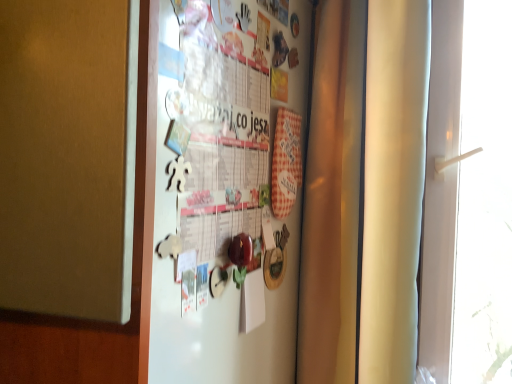
Locate an element on the screen. The width and height of the screenshot is (512, 384). white paperboard fridge at center is located at coordinates (224, 189).

In order to face white paperboard fridge at center, should I rotate leftwards or rightwards?

Rotate right and turn 0.875 degrees.

The image size is (512, 384). Describe the element at coordinates (224, 189) in the screenshot. I see `white paperboard fridge at center` at that location.

The image size is (512, 384). What are the coordinates of `white plastic handle at right` in the screenshot? It's located at (468, 198).

This screenshot has width=512, height=384. What do you see at coordinates (468, 198) in the screenshot?
I see `white plastic handle at right` at bounding box center [468, 198].

What is the approximate height of white plastic handle at right?

3.55 feet.

Measure the distance between point [436,375] and camera.

The distance of point [436,375] from camera is 4.06 feet.

The height and width of the screenshot is (384, 512). Find the location of `white paperboard fridge at center`. white paperboard fridge at center is located at coordinates (224, 189).

Is white paperboard fridge at center at the right side of white plastic handle at right?

Incorrect, white paperboard fridge at center is not on the right side of white plastic handle at right.

Which object is closer to the camera, white paperboard fridge at center or white plastic handle at right?

white paperboard fridge at center is closer to the camera.

Which is behind, point (278, 30) or point (484, 224)?

Point (484, 224)

From the image's perspective, is white paperboard fridge at center located above or below white plastic handle at right?

From the image's perspective, white paperboard fridge at center appears above white plastic handle at right.

From a real-world perspective, is white paperboard fridge at center physically located above or below white plastic handle at right?

Clearly, from a real-world perspective, white paperboard fridge at center is above white plastic handle at right.

In terms of width, does white paperboard fridge at center look wider or thinner when compared to white plastic handle at right?

white paperboard fridge at center is thinner than white plastic handle at right.

Considering the relative sizes of white paperboard fridge at center and white plastic handle at right in the image provided, is white paperboard fridge at center shorter than white plastic handle at right?

Yes.

Considering the sizes of white paperboard fridge at center and white plastic handle at right in the image, is white paperboard fridge at center bigger or smaller than white plastic handle at right?

Considering their sizes, white paperboard fridge at center takes up less space than white plastic handle at right.

Which is correct: white paperboard fridge at center is inside white plastic handle at right, or outside of it?

white paperboard fridge at center lies outside white plastic handle at right.

Is white paperboard fridge at center far away from white plastic handle at right?

No.

Is white paperboard fridge at center oriented away from white plastic handle at right?

No, white paperboard fridge at center is not facing away from white plastic handle at right.

How many degrees apart are the facing directions of white paperboard fridge at center and white plastic handle at right?

The angular difference between white paperboard fridge at center and white plastic handle at right is 93.1 degrees.

The image size is (512, 384). I want to click on window below the white paperboard fridge at center (from a real-world perspective), so click(468, 198).

Consider the image. Which object is positioned more to the right, white plastic handle at right or white paperboard fridge at center?

From the viewer's perspective, white plastic handle at right appears more on the right side.

Which object is further away from the camera, white plastic handle at right or white paperboard fridge at center?

white plastic handle at right is behind.

Which is nearer, (495, 49) or (265, 47)?

Point (265, 47)

From the image's perspective, between white plastic handle at right and white paperboard fridge at center, who is located below?

white plastic handle at right is shown below in the image.

From a real-world perspective, is white plastic handle at right above or below white paperboard fridge at center?

white plastic handle at right is below white paperboard fridge at center.

Which object is wider, white plastic handle at right or white paperboard fridge at center?

→ With larger width is white plastic handle at right.

Is white plastic handle at right taller than white paperboard fridge at center?

Yes, white plastic handle at right is taller than white paperboard fridge at center.

Who is bigger, white plastic handle at right or white paperboard fridge at center?

With larger size is white plastic handle at right.

Is white plastic handle at right spatially inside white paperboard fridge at center, or outside of it?

white plastic handle at right is located beyond the bounds of white paperboard fridge at center.

Is white plastic handle at right positioned far away from white paperboard fridge at center?

No, white plastic handle at right is in close proximity to white paperboard fridge at center.

Is white paperboard fridge at center at the back of white plastic handle at right?

No, white plastic handle at right is not facing the opposite direction of white paperboard fridge at center.

Can you tell me how much white plastic handle at right and white paperboard fridge at center differ in facing direction?

They differ by 93.1 degrees in their facing directions.

Measure the distance from white plastic handle at right to white paperboard fridge at center.

The distance of white plastic handle at right from white paperboard fridge at center is 24.25 inches.

Where is `window that appears on the right of white paperboard fridge at center`? The height and width of the screenshot is (384, 512). window that appears on the right of white paperboard fridge at center is located at coordinates (468, 198).

Locate an element on the screen. This screenshot has height=384, width=512. window below the white paperboard fridge at center (from the image's perspective) is located at coordinates (468, 198).

This screenshot has height=384, width=512. Identify the location of fridge above the white plastic handle at right (from the image's perspective). (224, 189).